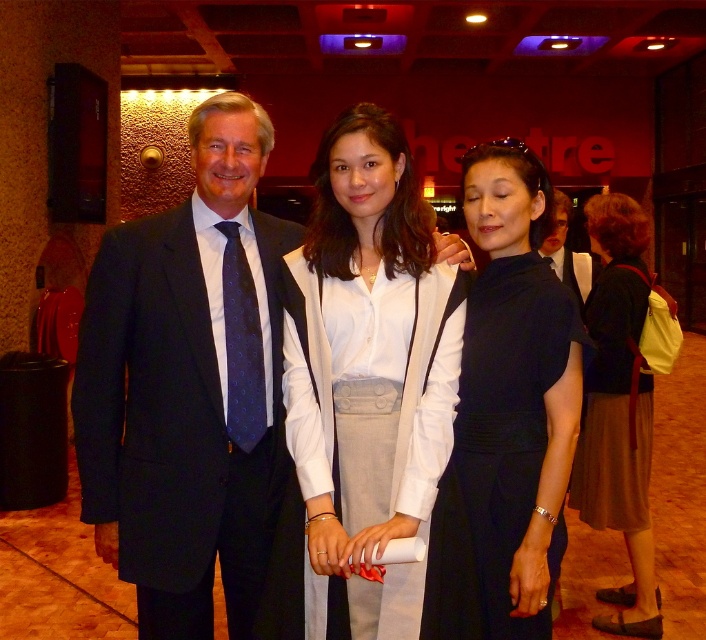
Question: Which of the following is the closest to the observer?

Choices:
 (A) dark blue suit at center
 (B) black satin dress at center
 (C) white cotton blouse at center
 (D) dark blue dotted tie at left

Answer: (C)

Question: In this image, where is matte black suit at center located relative to brown fabric skirt at lower right?

Choices:
 (A) above
 (B) below

Answer: (A)

Question: Based on their relative distances, which object is nearer to the white cotton blouse at center?

Choices:
 (A) matte black suit at center
 (B) dark blue dotted tie at left

Answer: (A)

Question: Which object appears closest to the camera in this image?

Choices:
 (A) white cotton blouse at center
 (B) black satin dress at center
 (C) dark blue dotted tie at left
 (D) dark blue suit at center

Answer: (A)

Question: Does dark blue suit at center appear over white cotton blouse at center?

Choices:
 (A) no
 (B) yes

Answer: (A)

Question: Does dark blue suit at center appear over black satin dress at center?

Choices:
 (A) no
 (B) yes

Answer: (B)